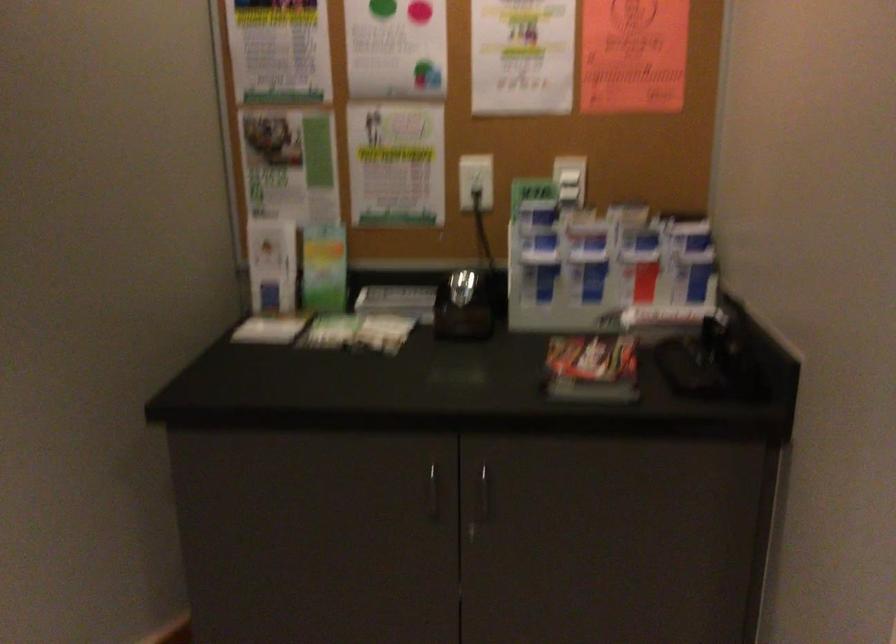
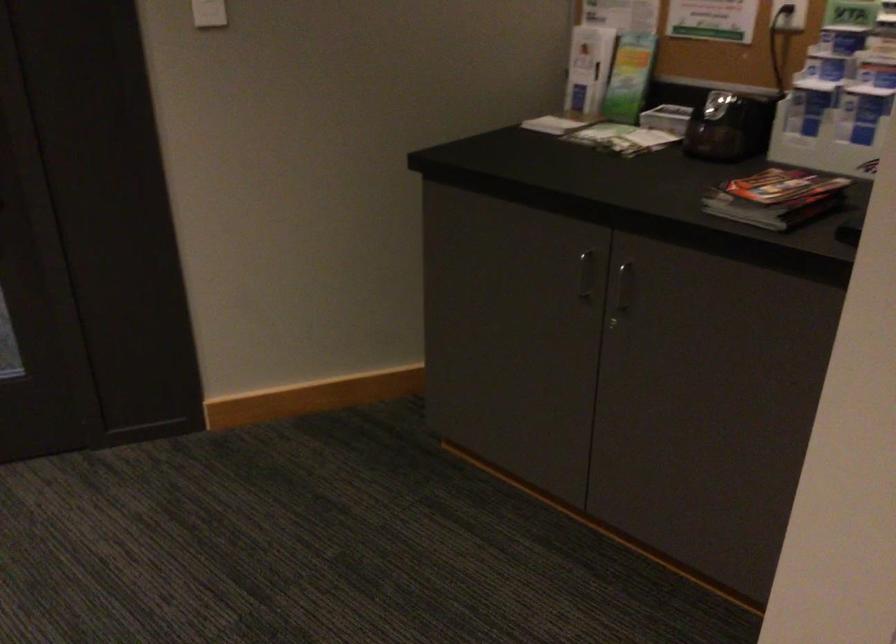
Question: The images are taken continuously from a first-person perspective. In which direction is your viewpoint rotating?

Choices:
 (A) Left
 (B) Right
 (C) Up
 (D) Down

Answer: (A)